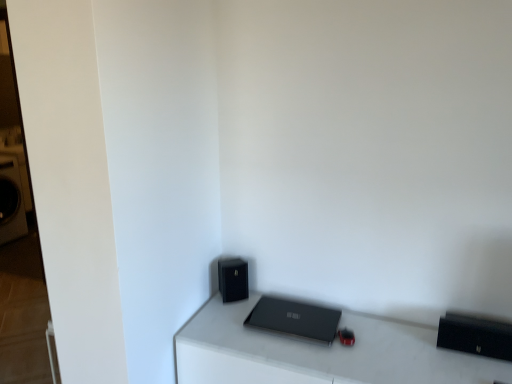
Question: From the image's perspective, is black matte speaker at lower center located above or below matte black laptop at center?

Choices:
 (A) above
 (B) below

Answer: (A)

Question: Choose the correct answer: Is black matte speaker at lower center inside matte black laptop at center or outside it?

Choices:
 (A) inside
 (B) outside

Answer: (B)

Question: Which of these objects is positioned closest to the matte black laptop at center?

Choices:
 (A) matte black laptop at center
 (B) black matte speaker at lower center

Answer: (A)

Question: Which is farther from the matte black laptop at center?

Choices:
 (A) black matte speaker at lower center
 (B) matte black laptop at center

Answer: (A)